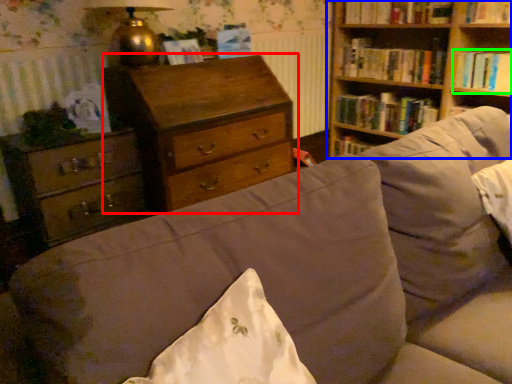
Question: Which object is the closest to the chest of drawers (highlighted by a red box)? Choose among these: bookcase (highlighted by a blue box) or book (highlighted by a green box).

Choices:
 (A) bookcase
 (B) book

Answer: (A)